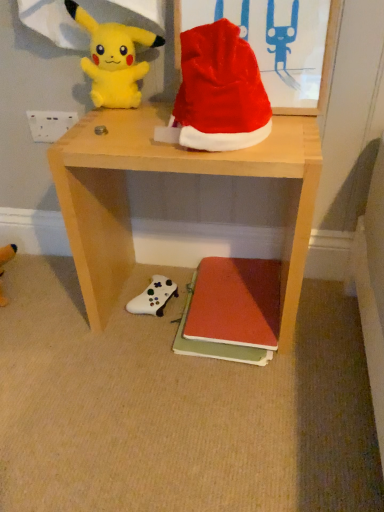
Question: Does point (251, 50) appear closer or farther from the camera than point (157, 280)?

Choices:
 (A) closer
 (B) farther

Answer: (A)

Question: In terms of width, does shiny fabric santa hat at upper center look wider or thinner when compared to white matte game controller at lower center, acting as the first toy starting from the back?

Choices:
 (A) wide
 (B) thin

Answer: (B)

Question: Which object is the closest to the matte red book at lower center?

Choices:
 (A) yellow plush toy at upper left, which is counted as the second toy, starting from the back
 (B) white matte game controller at lower center, acting as the first toy starting from the back
 (C) white plastic power outlet at upper left
 (D) shiny fabric santa hat at upper center
 (E) wooden desk at center

Answer: (B)

Question: Which object is the farthest from the white plastic power outlet at upper left?

Choices:
 (A) wooden desk at center
 (B) matte red book at lower center
 (C) yellow plush toy at upper left, acting as the 2th toy starting from the bottom
 (D) shiny fabric santa hat at upper center
 (E) white matte game controller at lower center, positioned as the 2th toy in top-to-bottom order

Answer: (B)